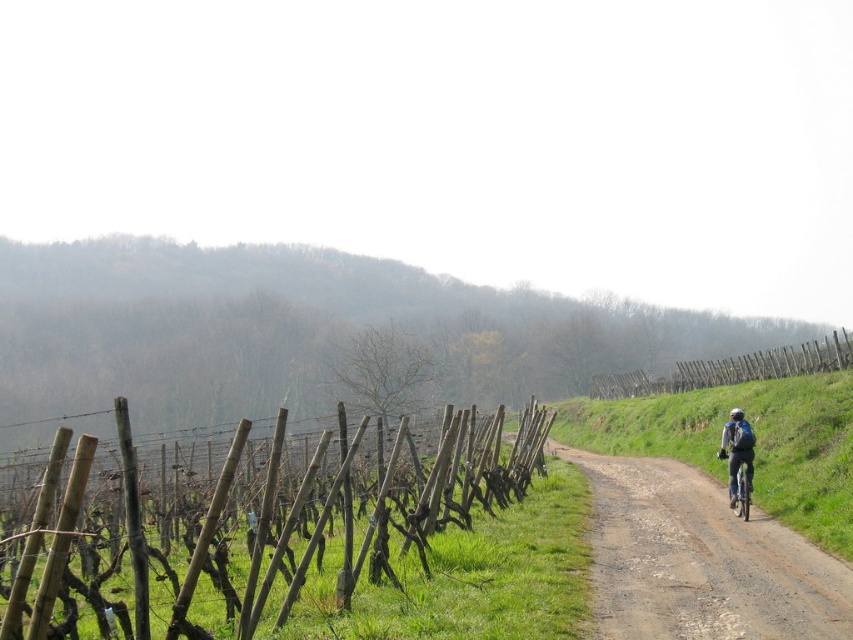
Can you confirm if dirt/gravel road at center-right is positioned below matte blue bicycle at right?

Yes, dirt/gravel road at center-right is below matte blue bicycle at right.

Who is more distant from viewer, (785, 579) or (735, 486)?

The point (735, 486) is behind.

Where is `dirt/gravel road at center-right`? The width and height of the screenshot is (853, 640). dirt/gravel road at center-right is located at coordinates (700, 561).

Can you confirm if matte blue bicycle at right is positioned to the left of shiny blue helmet at right?

Correct, you'll find matte blue bicycle at right to the left of shiny blue helmet at right.

Can you confirm if matte blue bicycle at right is taller than shiny blue helmet at right?

Indeed, matte blue bicycle at right has a greater height compared to shiny blue helmet at right.

You are a GUI agent. You are given a task and a screenshot of the screen. Output one action in this format:
    pyautogui.click(x=<x>, y=<y>)
    Task: Click on the matte blue bicycle at right
    This screenshot has width=853, height=640.
    Given the screenshot: What is the action you would take?
    pyautogui.click(x=738, y=461)

Image resolution: width=853 pixels, height=640 pixels. I want to click on matte blue bicycle at right, so click(x=738, y=461).

Which is above, green fabric helmet at right or shiny blue helmet at right?

shiny blue helmet at right is higher up.

Which is behind, point (740, 444) or point (732, 413)?

Positioned behind is point (732, 413).

Between point (752, 435) and point (735, 413), which one is positioned behind?

Positioned behind is point (735, 413).

The width and height of the screenshot is (853, 640). Identify the location of green fabric helmet at right. click(737, 451).